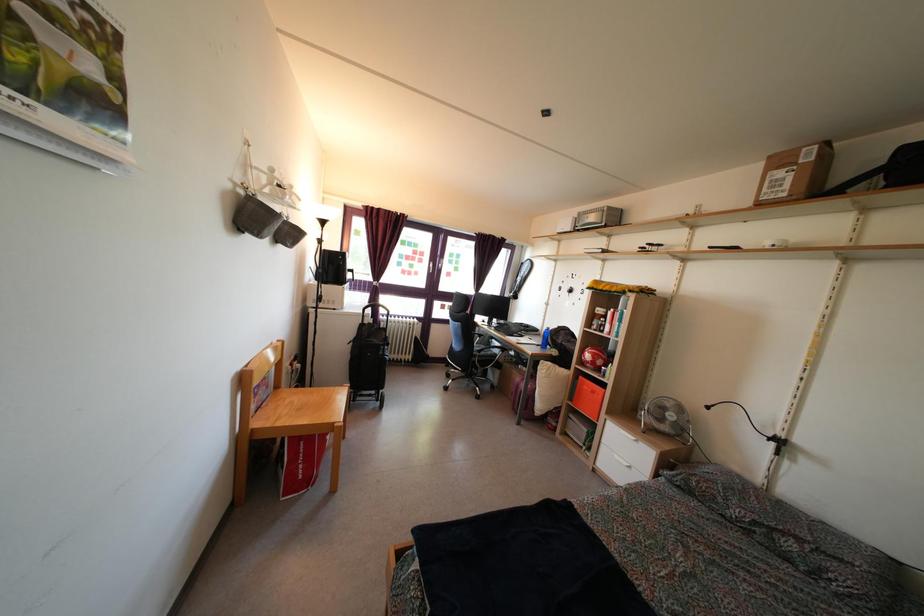
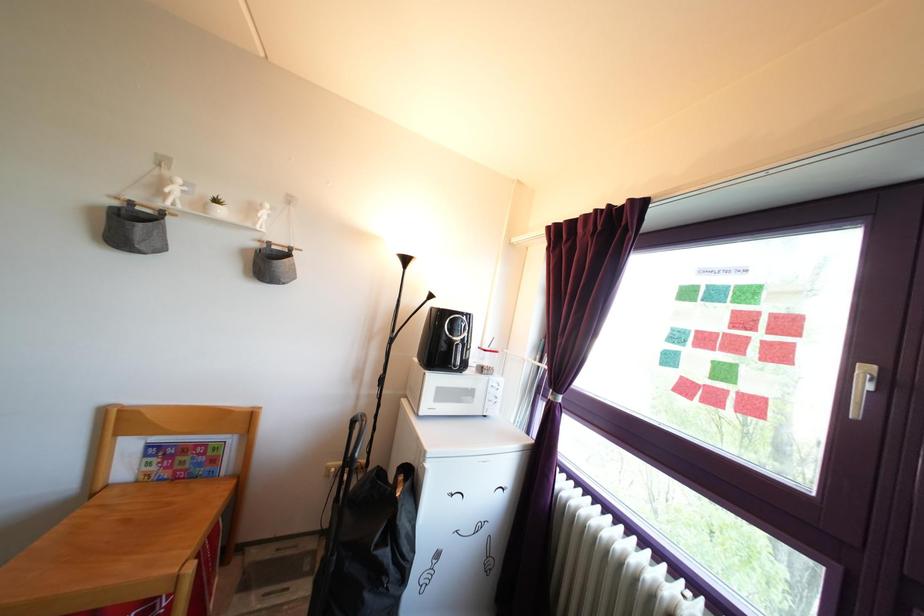
In the second image, find the point that corresponds to pixel 433 270 in the first image.

(857, 365)